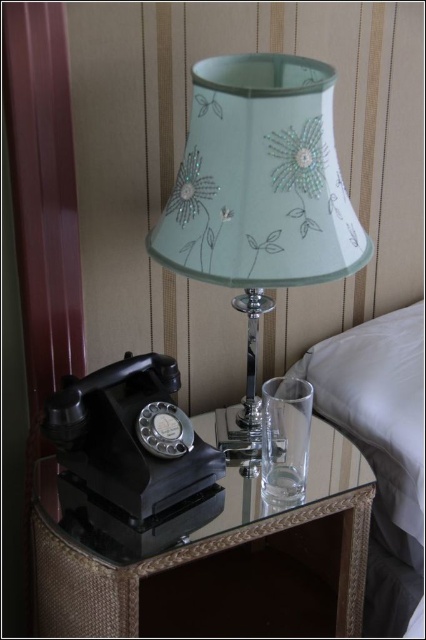
Question: Which object is positioned farthest from the matte black rotary phone at left?

Choices:
 (A) white fabric bed at right
 (B) black glass table at lower left
 (C) transparent glass cup at center

Answer: (A)

Question: Which point is closer to the camera taking this photo?

Choices:
 (A) click(296, 429)
 (B) click(112, 394)
 (C) click(273, 618)

Answer: (B)

Question: Among these points, which one is farthest from the camera?

Choices:
 (A) (253, 198)
 (B) (333, 518)
 (C) (296, 394)
 (D) (54, 410)

Answer: (B)

Question: Does white fabric bed at right have a lesser width compared to transparent glass cup at center?

Choices:
 (A) yes
 (B) no

Answer: (B)

Question: Is white fabric bed at right bigger than transparent glass cup at center?

Choices:
 (A) yes
 (B) no

Answer: (A)

Question: Observing the image, what is the correct spatial positioning of white fabric bed at right in reference to matte black rotary phone at left?

Choices:
 (A) above
 (B) below

Answer: (B)